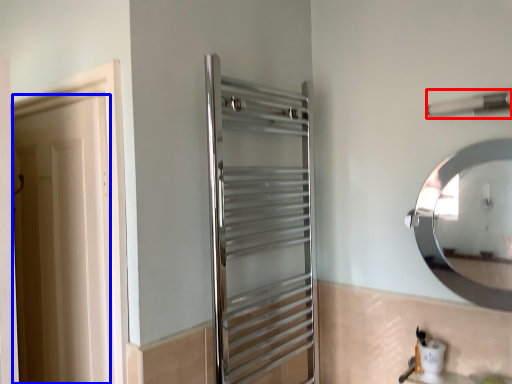
Question: Which of the following is the closest to the observer, towel bar (highlighted by a red box) or door (highlighted by a blue box)?

Choices:
 (A) towel bar
 (B) door

Answer: (A)